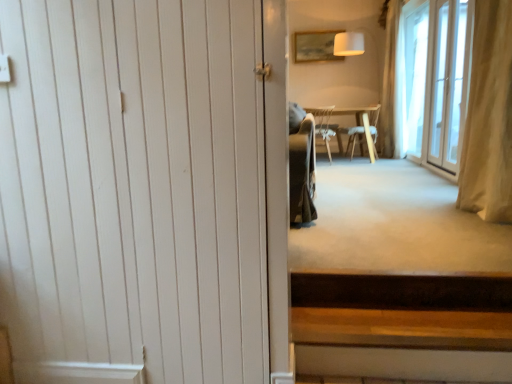
Question: Is light brown wooden chair at center, positioned as the second chair in left-to-right order, far from white sheer curtain at right, which appears as the 1th curtain when viewed from the right?

Choices:
 (A) yes
 (B) no

Answer: (B)

Question: Does light brown wooden chair at center, the first chair viewed from the right, have a smaller size compared to white sheer curtain at right, placed as the 2th curtain when sorted from front to back?

Choices:
 (A) yes
 (B) no

Answer: (A)

Question: From a real-world perspective, is light brown wooden chair at center, the first chair viewed from the right, positioned under white sheer curtain at right, placed as the 2th curtain when sorted from front to back, based on gravity?

Choices:
 (A) no
 (B) yes

Answer: (B)

Question: Can you confirm if light brown wooden chair at center, positioned as the second chair in left-to-right order, is taller than white sheer curtain at right, the 1th curtain from the back?

Choices:
 (A) yes
 (B) no

Answer: (B)

Question: Is the position of light brown wooden chair at center, positioned as the second chair in left-to-right order, more distant than that of white sheer curtain at right, placed as the 2th curtain when sorted from front to back?

Choices:
 (A) yes
 (B) no

Answer: (A)

Question: Does light brown wooden chair at center, positioned as the second chair in left-to-right order, turn towards white sheer curtain at right, which appears as the 1th curtain when viewed from the right?

Choices:
 (A) no
 (B) yes

Answer: (A)

Question: Is beige fabric curtain at right, arranged as the first curtain when viewed from the front, not near transparent glass door at right?

Choices:
 (A) no
 (B) yes

Answer: (B)

Question: Is beige fabric curtain at right, arranged as the first curtain when viewed from the front, at the left side of transparent glass door at right?

Choices:
 (A) no
 (B) yes

Answer: (B)

Question: Does beige fabric curtain at right, acting as the second curtain starting from the back, turn towards transparent glass door at right?

Choices:
 (A) yes
 (B) no

Answer: (B)

Question: Is beige fabric curtain at right, arranged as the first curtain when viewed from the front, shorter than transparent glass door at right?

Choices:
 (A) no
 (B) yes

Answer: (B)

Question: Would you say beige fabric curtain at right, which is the first curtain from left to right, is outside transparent glass door at right?

Choices:
 (A) no
 (B) yes

Answer: (B)

Question: Can you confirm if beige fabric curtain at right, which is counted as the 2th curtain, starting from the right, is wider than transparent glass door at right?

Choices:
 (A) no
 (B) yes

Answer: (B)

Question: From the image's perspective, is white wood door at left on top of light brown wooden chair at center, positioned as the second chair in left-to-right order?

Choices:
 (A) yes
 (B) no

Answer: (B)